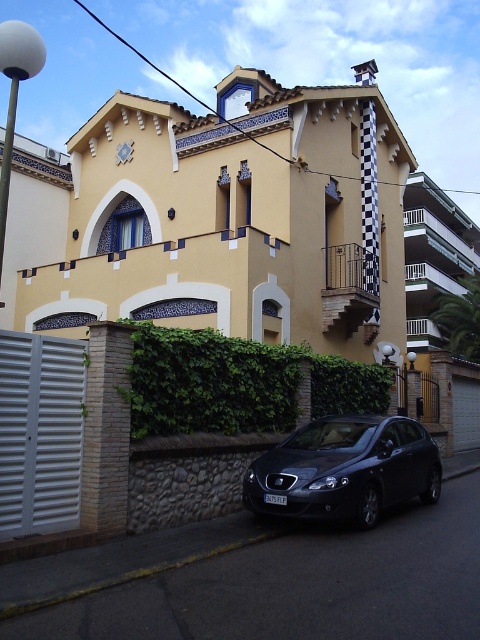
Question: Does green leafy hedge at center have a smaller size compared to matte black car at lower center?

Choices:
 (A) no
 (B) yes

Answer: (B)

Question: Is green leafy hedge at center in front of matte black car at lower center?

Choices:
 (A) yes
 (B) no

Answer: (B)

Question: Where is green leafy hedge at center located in relation to matte black car at lower center in the image?

Choices:
 (A) left
 (B) right

Answer: (A)